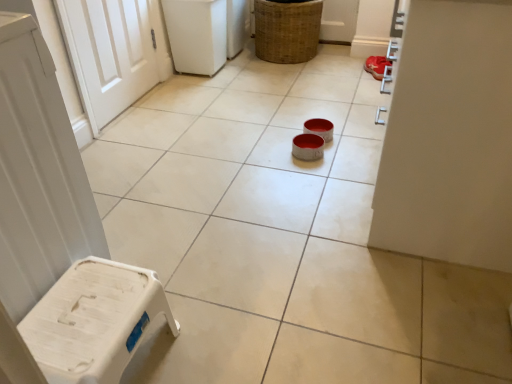
Locate an element on the screen. free space that is to the left of woven brown basket at upper center is located at coordinates (244, 74).